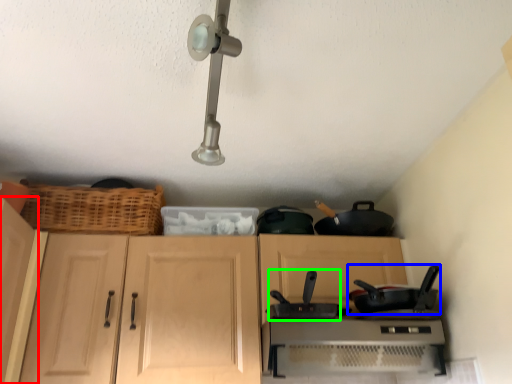
Question: Which object is the closest to the cabinetry (highlighted by a red box)? Choose among these: frying pan (highlighted by a blue box) or wok (highlighted by a green box).

Choices:
 (A) frying pan
 (B) wok

Answer: (B)